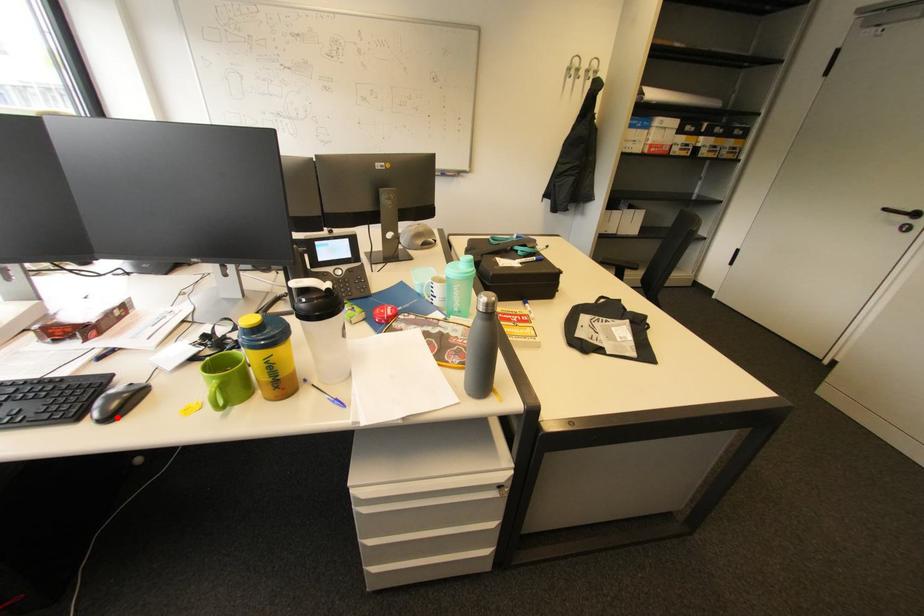
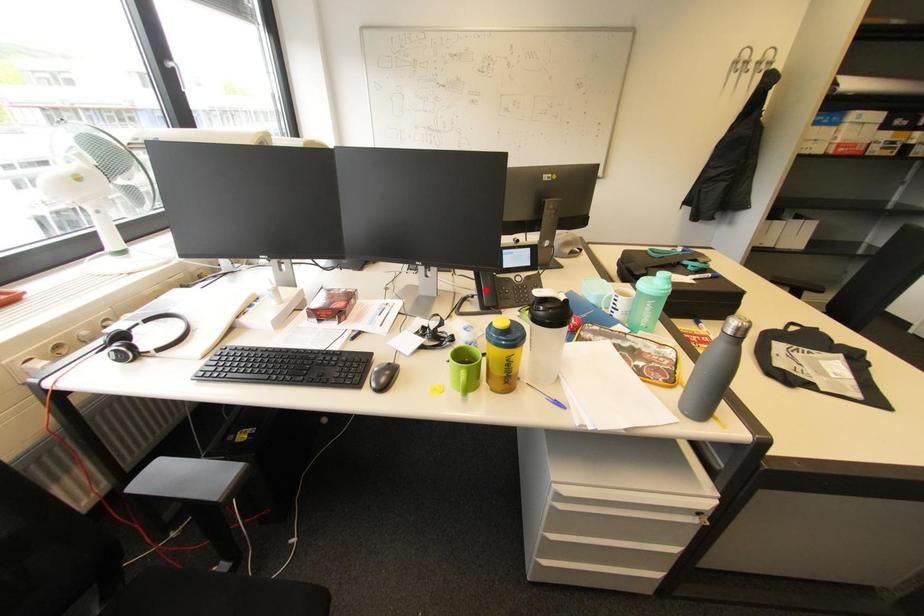
I am providing you with two images of the same scene from different viewpoints. A red point is marked on the first image and another point is marked on the second image. Are the points marked in image1 and image2 representing the same 3D position?

No